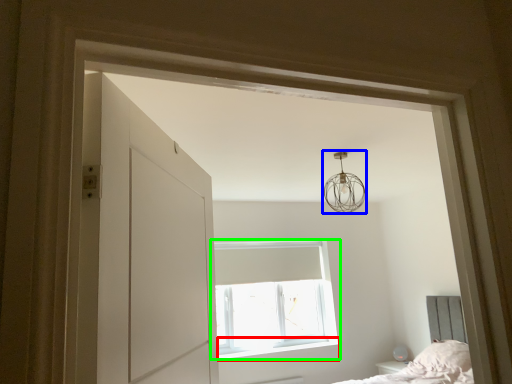
Question: Which object is positioned closest to window sill (highlighted by a red box)? Select from lamp (highlighted by a blue box) and window (highlighted by a green box).

Choices:
 (A) lamp
 (B) window

Answer: (B)